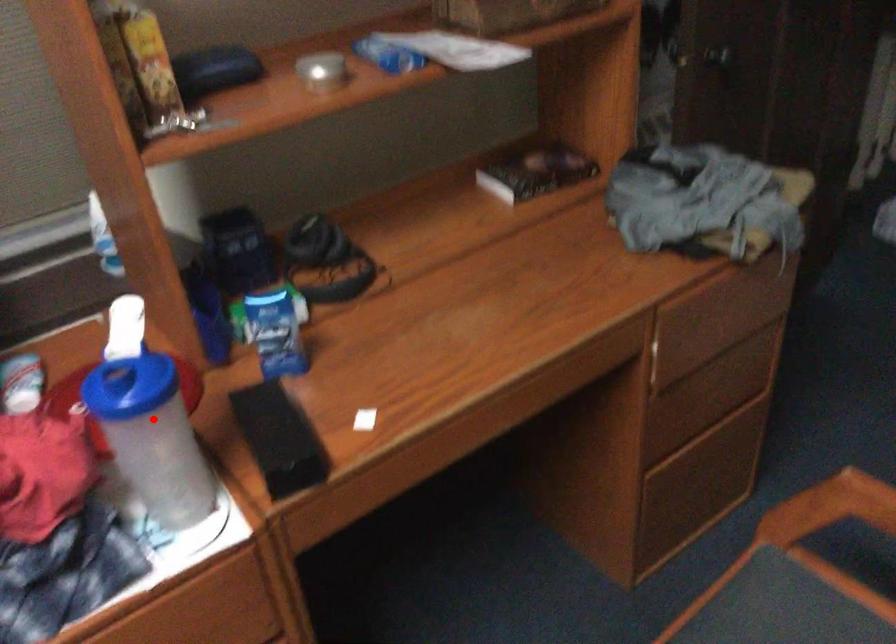
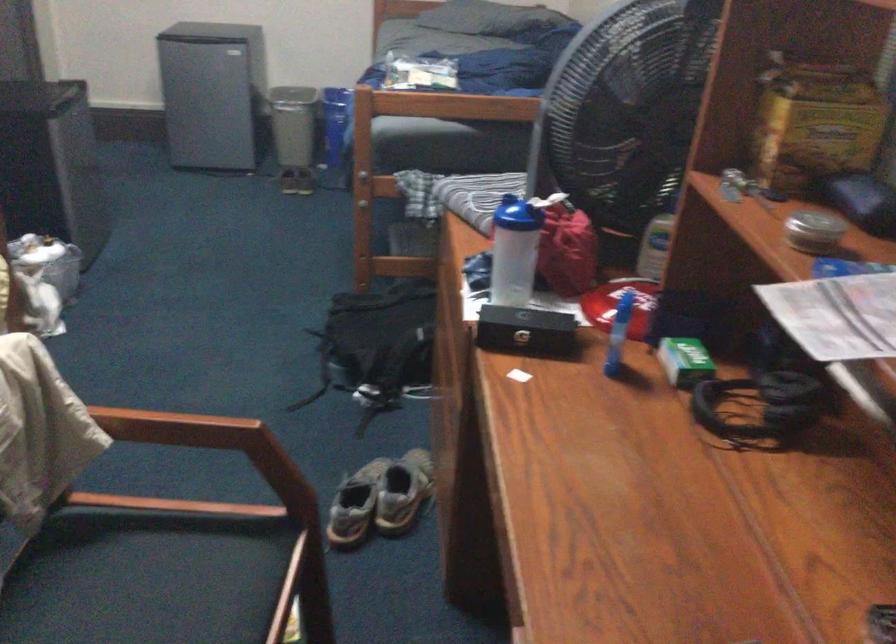
Find the pixel in the second image that matches the highlighted location in the first image.

(513, 251)